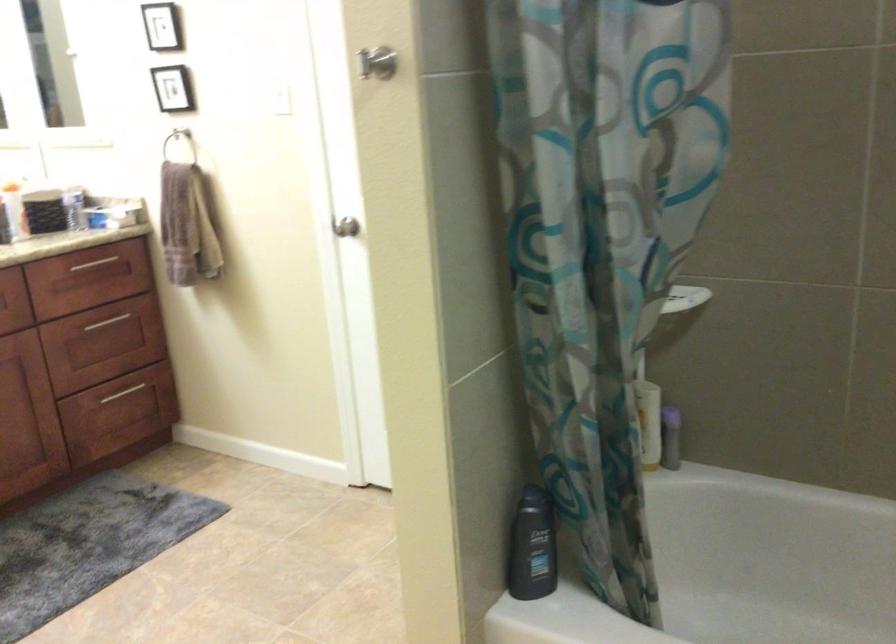
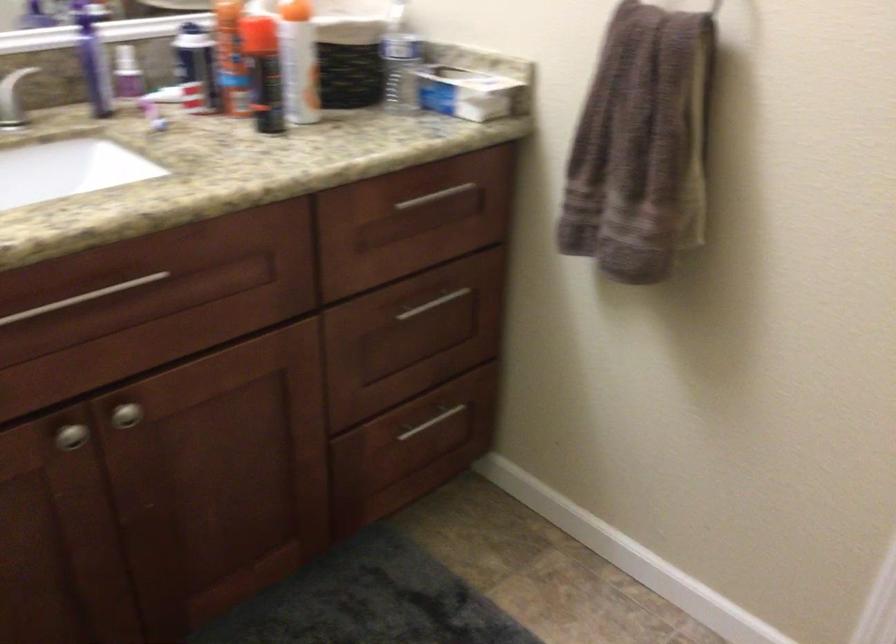
In the second image, find the point that corresponds to point (117, 207) in the first image.

(470, 91)